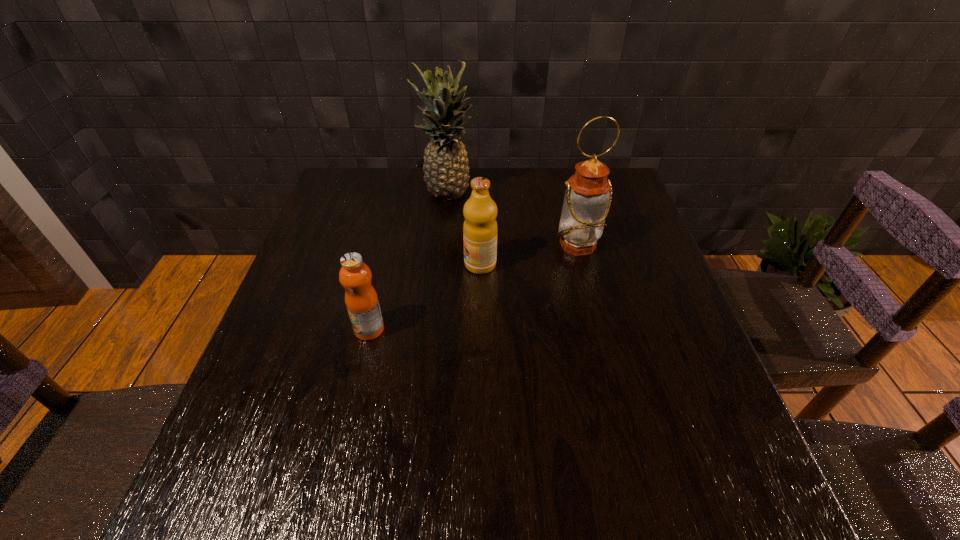
Find the location of a particular element. the closest object to the nearest object is located at coordinates (480, 229).

At what (x,y) coordinates should I click in order to perform the action: click on free location that satisfies the following two spatial constraints: 1. on the front side of the pineapple; 2. on the left side of the rightmost object. Please return your answer as a coordinate pair (x, y). The width and height of the screenshot is (960, 540). Looking at the image, I should click on (442, 245).